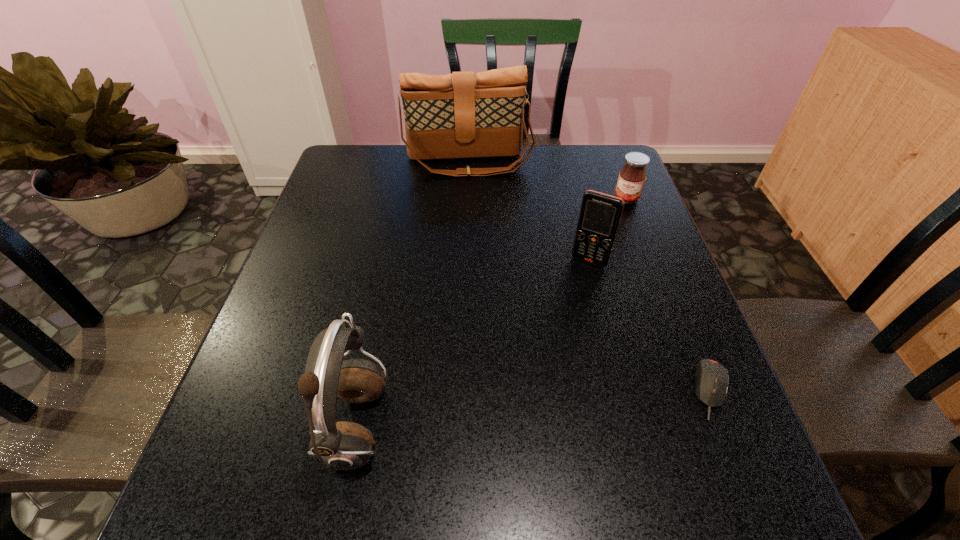
At what (x,y) coordinates should I click in order to perform the action: click on earphone. Please return your answer as a coordinate pair (x, y). This screenshot has height=540, width=960. Looking at the image, I should click on (343, 445).

Where is `the shortest object`? The height and width of the screenshot is (540, 960). the shortest object is located at coordinates (711, 378).

Find the location of a particular element. The image size is (960, 540). jam is located at coordinates (632, 177).

The image size is (960, 540). In order to click on the fourth nearest object in this screenshot , I will do `click(632, 177)`.

The width and height of the screenshot is (960, 540). Identify the location of the farthest object. (460, 115).

Locate an element on the screen. This screenshot has height=540, width=960. the third object from right to left is located at coordinates (600, 214).

What are the coordinates of `the third farthest object` in the screenshot? It's located at (600, 214).

Identify the location of free location located on the ear pads of the earphone. The width and height of the screenshot is (960, 540). (583, 428).

What are the coordinates of `vacant space positioned 0.090m on the back of the shortest object` in the screenshot? It's located at (686, 325).

At what (x,y) coordinates should I click in order to perform the action: click on vacant space situated 0.220m on the label side of the fourth nearest object. Please return your answer as a coordinate pair (x, y). Looking at the image, I should click on (604, 254).